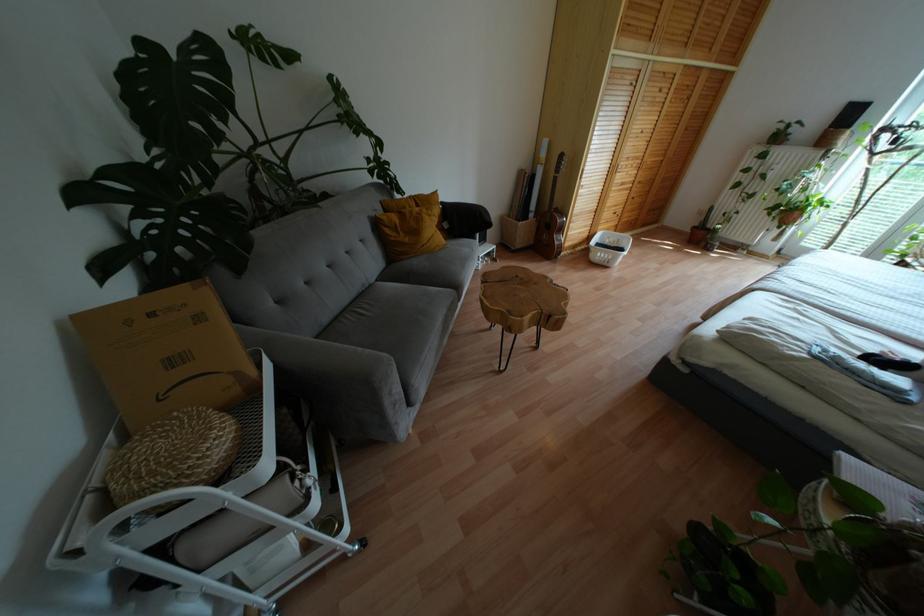
What do you see at coordinates (166, 353) in the screenshot? The width and height of the screenshot is (924, 616). I see `the cardboard mailer` at bounding box center [166, 353].